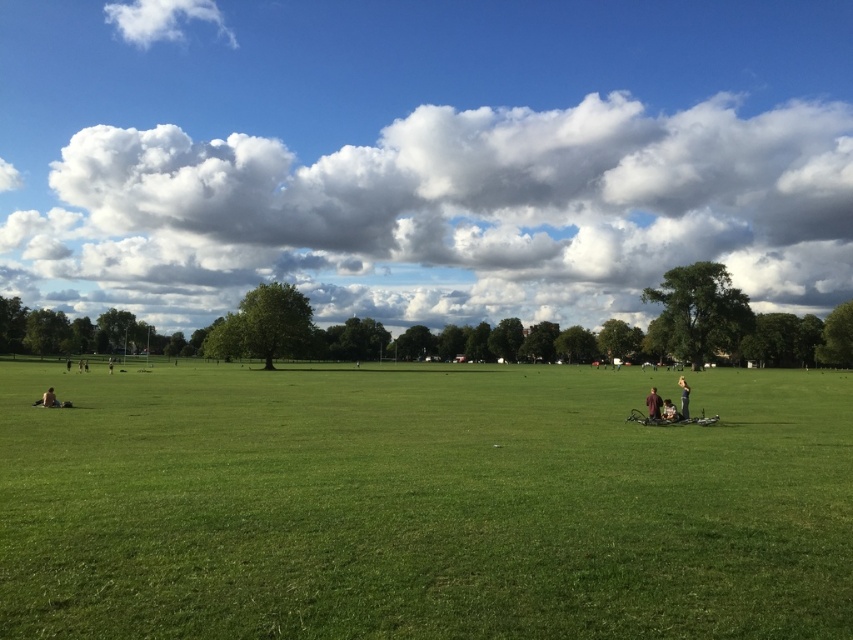
Question: Which object is positioned farthest from the green grass at center?

Choices:
 (A) brown leather jacket at lower right
 (B) cloudy sky at upper center
 (C) dark gray fabric person at lower right
 (D) white fabric jacket at lower center

Answer: (B)

Question: Does brown leather jacket at lower right have a smaller size compared to white fabric jacket at lower center?

Choices:
 (A) no
 (B) yes

Answer: (A)

Question: Is green grass at center thinner than dark gray fabric person at lower right?

Choices:
 (A) yes
 (B) no

Answer: (B)

Question: Among these objects, which one is farthest from the camera?

Choices:
 (A) green grass at center
 (B) cloudy sky at upper center
 (C) brown leather jacket at lower right
 (D) white fabric jacket at lower center

Answer: (B)

Question: Does cloudy sky at upper center lie in front of white fabric jacket at lower center?

Choices:
 (A) no
 (B) yes

Answer: (A)

Question: Which of the following is the closest to the observer?

Choices:
 (A) click(x=285, y=628)
 (B) click(x=74, y=160)
 (C) click(x=680, y=397)
 (D) click(x=650, y=417)

Answer: (A)